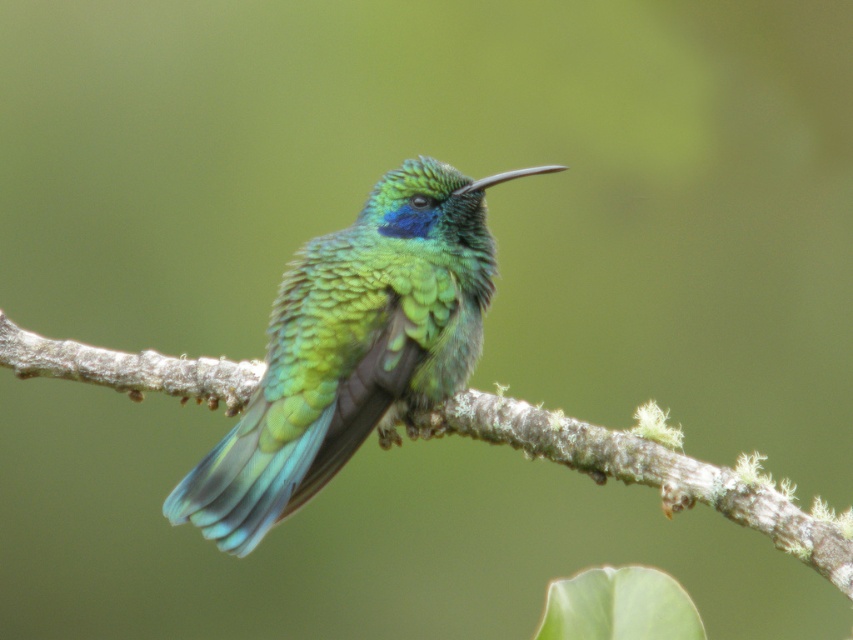
You are a photographer aiming to capture a closeup shot of the shiny green hummingbird at center. Your camera has a minimum focusing distance of 5 feet. Will you be able to take the photo without moving closer than 7.16 feet?

The distance between the shiny green hummingbird at center and the camera is 7.16 feet, which is greater than the camera minimum focusing distance of 5 feet. Therefore, you can take the photo without moving closer than 7.16 feet.

In the scene shown: You are a birdwatcher observing the scene. You notice the shiny green hummingbird at center and the brown rough tree branch at center. Which object is located more to the left?

The shiny green hummingbird at center is positioned on the left side of brown rough tree branch at center, so it is more to the left.

You are a photographer trying to capture the hummingbird in the image. The hummingbird is currently at point [352,348]. If you want to focus on the hummingbird, where should you aim your camera?

You should aim your camera at point [352,348], where the shiny green hummingbird at center is located.